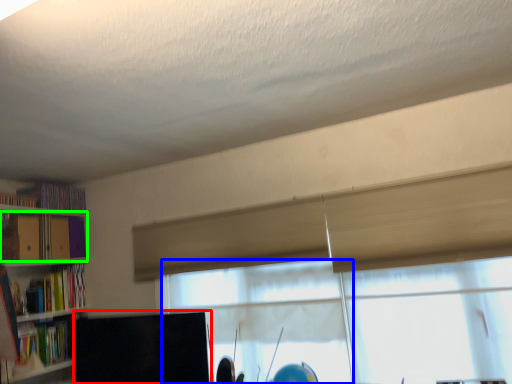
Question: Considering the real-world distances, which object is closest to computer monitor (highlighted by a red box)? window (highlighted by a blue box) or book (highlighted by a green box).

Choices:
 (A) window
 (B) book

Answer: (A)